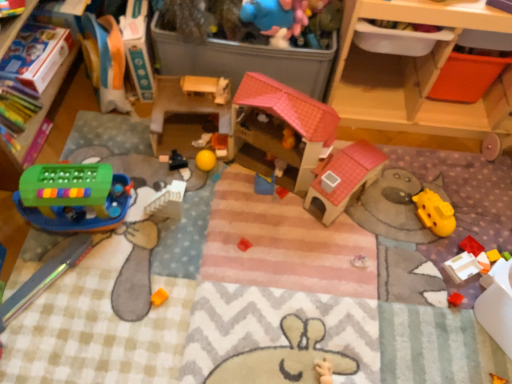
At what (x,y) coordinates should I click in order to perform the action: click on empty space that is in between bright red plastic block at lower right, which appears as the first toy when viewed from the right, and yellow rubber ball at center, the fifth toy in the right-to-left sequence. Please return your answer as a coordinate pair (x, y). Looking at the image, I should click on (346, 214).